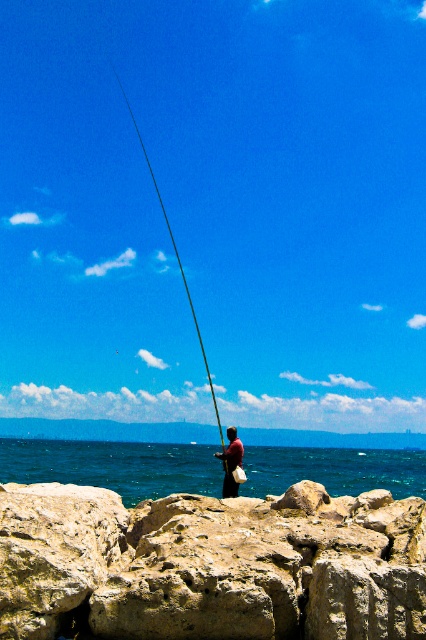
You are a hiker who has just arrived at the rocky shoreline. You see the black rod fishing pole at center and the brown leather bag at center. Which object is located more to the left?

The black rod fishing pole at center is positioned on the left side of the brown leather bag at center, so it is more to the left.

You are a photographer trying to capture the fishing scene. You notice the black rod fishing pole at center and the brown leather bag at center. Which object should you focus on if you want to capture the wider object in your shot?

The black rod fishing pole at center is wider than the brown leather bag at center, so you should focus on the black rod fishing pole at center to capture the wider object in your shot.